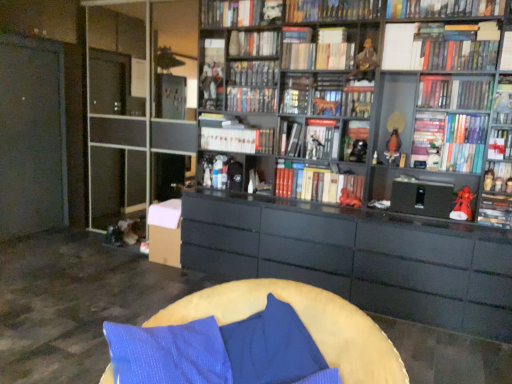
This screenshot has width=512, height=384. I want to click on hardcover book at upper center, which is counted as the 3th book, starting from the top, so click(x=443, y=8).

The image size is (512, 384). What do you see at coordinates (272, 347) in the screenshot?
I see `blue fabric pillow at lower center` at bounding box center [272, 347].

This screenshot has height=384, width=512. Describe the element at coordinates (251, 99) in the screenshot. I see `black matte bookshelf at center, which appears as the eleventh book when ordered from the bottom` at that location.

Identify the location of hardcover book at center, the 7th book positioned from the bottom. (290, 138).

I want to click on hardcover book at right, which is the 19th book in top-to-bottom order, so click(495, 210).

Is matte plastic figurine at upper center, positioned as the sixth book in top-to-bottom order, facing away from hardcover book at upper center, arranged as the 19th book when ordered from the bottom?

matte plastic figurine at upper center, positioned as the sixth book in top-to-bottom order, does not have its back to hardcover book at upper center, arranged as the 19th book when ordered from the bottom.

Is point (206, 52) farther from camera compared to point (218, 10)?

No, it is not.

Considering the sizes of objects matte plastic figurine at upper center, positioned as the sixth book in top-to-bottom order, and hardcover book at upper center, acting as the 1th book starting from the top, in the image provided, who is thinner, matte plastic figurine at upper center, positioned as the sixth book in top-to-bottom order, or hardcover book at upper center, acting as the 1th book starting from the top,?

matte plastic figurine at upper center, positioned as the sixth book in top-to-bottom order.

From the image's perspective, is matte plastic figurine at upper center, positioned as the sixth book in top-to-bottom order, beneath hardcover book at upper center, acting as the 1th book starting from the top?

Yes, from the image's perspective, matte plastic figurine at upper center, positioned as the sixth book in top-to-bottom order, is below hardcover book at upper center, acting as the 1th book starting from the top.

Could you tell me if soft yellow cushion at lower center is turned towards matte black book at center, the 14th book in the top-to-bottom sequence?

No, soft yellow cushion at lower center is not oriented towards matte black book at center, the 14th book in the top-to-bottom sequence.

Considering their positions, is soft yellow cushion at lower center located in front of or behind matte black book at center, which appears as the sixth book when ordered from the bottom?

In the image, soft yellow cushion at lower center appears in front of matte black book at center, which appears as the sixth book when ordered from the bottom.

Does point (265, 290) appear closer or farther from the camera than point (344, 147)?

Clearly, point (265, 290) is closer to the camera than point (344, 147).

Is there a large distance between matte plastic figurine at upper center, positioned as the sixth book in top-to-bottom order, and hardcover book at upper right, the 9th book positioned from the bottom?

That's right, there is a large distance between matte plastic figurine at upper center, positioned as the sixth book in top-to-bottom order, and hardcover book at upper right, the 9th book positioned from the bottom.

Does matte plastic figurine at upper center, acting as the 14th book starting from the bottom, have a lesser width compared to hardcover book at upper right, the 9th book positioned from the bottom?

No, matte plastic figurine at upper center, acting as the 14th book starting from the bottom, is not thinner than hardcover book at upper right, the 9th book positioned from the bottom.

Can you confirm if matte plastic figurine at upper center, acting as the 14th book starting from the bottom, is positioned to the right of hardcover book at upper right, the 9th book positioned from the bottom?

No, matte plastic figurine at upper center, acting as the 14th book starting from the bottom, is not to the right of hardcover book at upper right, the 9th book positioned from the bottom.

From a real-world perspective, which object rests below the other?

red matte bookshelf at center, the 2th book ordered from the bottom, is physically lower.

Can you confirm if red matte bookshelf at center, the 2th book ordered from the bottom, is shorter than white glossy book at upper right, the 16th book positioned from the top?

Incorrect, the height of red matte bookshelf at center, the 2th book ordered from the bottom, does not fall short of that of white glossy book at upper right, the 16th book positioned from the top.

Considering the relative positions of red matte bookshelf at center, marked as the eighteenth book in a top-to-bottom arrangement, and white glossy book at upper right, the 16th book positioned from the top, in the image provided, is red matte bookshelf at center, marked as the eighteenth book in a top-to-bottom arrangement, to the right of white glossy book at upper right, the 16th book positioned from the top, from the viewer's perspective?

No.

Could you tell me if red matte bookshelf at center, the 2th book ordered from the bottom, is turned towards white glossy book at upper right, which ranks as the 4th book in bottom-to-top order?

No, red matte bookshelf at center, the 2th book ordered from the bottom, is not turned towards white glossy book at upper right, which ranks as the 4th book in bottom-to-top order.

Is matte red figurine at right in contact with hardcover book at upper right, the twelfth book when ordered from bottom to top?

matte red figurine at right and hardcover book at upper right, the twelfth book when ordered from bottom to top, are not in contact.

Is matte red figurine at right spatially inside hardcover book at upper right, the twelfth book when ordered from bottom to top, or outside of it?

The correct answer is: outside.

Is matte red figurine at right closer to camera compared to hardcover book at upper right, the twelfth book when ordered from bottom to top?

No, matte red figurine at right is behind hardcover book at upper right, the twelfth book when ordered from bottom to top.

From a real-world perspective, who is located higher, matte red figurine at right or hardcover book at upper right, the twelfth book when ordered from bottom to top?

From a 3D spatial view, hardcover book at upper right, the twelfth book when ordered from bottom to top, is above.

Consider the image. Which is closer to the camera, (344, 33) or (492, 215)?

Clearly, point (344, 33) is more distant from the camera than point (492, 215).

Is the depth of hardcover book at center, the fifteenth book when ordered from bottom to top, greater than that of hardcover book at right, marked as the first book in a bottom-to-top arrangement?

Yes, it is.

Which of these two, hardcover book at center, arranged as the 5th book when viewed from the top, or hardcover book at right, marked as the first book in a bottom-to-top arrangement, stands taller?

Standing taller between the two is hardcover book at right, marked as the first book in a bottom-to-top arrangement.

Consider the image. Which is behind, black matte bookshelf at center, which appears as the 9th book when viewed from the top, or hardcover book at upper right, which ranks as the fifteenth book in top-to-bottom order?

black matte bookshelf at center, which appears as the 9th book when viewed from the top, is more distant.

From the image's perspective, is black matte bookshelf at center, which appears as the eleventh book when ordered from the bottom, located beneath hardcover book at upper right, the 5th book ordered from the bottom?

No, from the image's perspective, black matte bookshelf at center, which appears as the eleventh book when ordered from the bottom, is not beneath hardcover book at upper right, the 5th book ordered from the bottom.

Image resolution: width=512 pixels, height=384 pixels. Find the location of `the 9th book in front when counting from the black matte bookshelf at center, which appears as the eleventh book when ordered from the bottom`. the 9th book in front when counting from the black matte bookshelf at center, which appears as the eleventh book when ordered from the bottom is located at coordinates [428, 138].

How different are the orientations of black matte bookshelf at center, which appears as the eleventh book when ordered from the bottom, and hardcover book at upper right, which ranks as the fifteenth book in top-to-bottom order, in degrees?

The facing directions of black matte bookshelf at center, which appears as the eleventh book when ordered from the bottom, and hardcover book at upper right, which ranks as the fifteenth book in top-to-bottom order, are 0.312 degrees apart.

The height and width of the screenshot is (384, 512). I want to click on book that is the 7th one above the matte plastic figurine at upper center, positioned as the sixth book in top-to-bottom order (from a real-world perspective), so click(230, 13).

The image size is (512, 384). I want to click on furniture directly beneath the matte black book at center, which appears as the sixth book when ordered from the bottom (from a real-world perspective), so click(303, 322).

Estimate the real-world distances between objects in this image. Which object is closer to red matte bookshelf at center, marked as the eighteenth book in a top-to-bottom arrangement, hardcover book at upper right, which ranks as the fifteenth book in top-to-bottom order, or matte black bookcase at upper right?

Based on the image, matte black bookcase at upper right appears to be nearer to red matte bookshelf at center, marked as the eighteenth book in a top-to-bottom arrangement.

When comparing their distances from matte black figurine at right, acting as the seventeenth book starting from the top, does white glossy book at upper right, the 16th book positioned from the top, or soft yellow cushion at lower center seem further?

soft yellow cushion at lower center is further to matte black figurine at right, acting as the seventeenth book starting from the top.

Considering their positions, is matte plastic figurine at upper center, acting as the 14th book starting from the bottom, positioned further to hardcover book at center, the 7th book positioned from the bottom, than hardcover book at upper center, arranged as the 19th book when ordered from the bottom?

Among the two, hardcover book at upper center, arranged as the 19th book when ordered from the bottom, is located further to hardcover book at center, the 7th book positioned from the bottom.

Based on their spatial positions, is hardcover book at upper right, the 5th book ordered from the bottom, or matte black figurine at right, acting as the seventeenth book starting from the top, further from soft yellow cushion at lower center?

Among the two, matte black figurine at right, acting as the seventeenth book starting from the top, is located further to soft yellow cushion at lower center.

Based on their spatial positions, is soft yellow cushion at lower center or matte black figurine at right, the 3th book from the bottom, closer to black matte bookshelf at center, which appears as the eleventh book when ordered from the bottom?

Among the two, matte black figurine at right, the 3th book from the bottom, is located nearer to black matte bookshelf at center, which appears as the eleventh book when ordered from the bottom.

From the picture: When comparing their distances from hardcover book at upper center, arranged as the 4th book when viewed from the top, does black matte bookshelf at center, which appears as the eleventh book when ordered from the bottom, or hardcover book at right, which is the 19th book in top-to-bottom order, seem further?

hardcover book at right, which is the 19th book in top-to-bottom order, is positioned further to the anchor hardcover book at upper center, arranged as the 4th book when viewed from the top.

Looking at the image, which one is located closer to hardcover book at upper center, the eighteenth book positioned from the bottom, matte red figurine at right or hardcover book at upper right, which is the eighth book in bottom-to-top order?

hardcover book at upper right, which is the eighth book in bottom-to-top order, lies closer to hardcover book at upper center, the eighteenth book positioned from the bottom, than the other object.

Based on their spatial positions, is hardcover book at right, marked as the first book in a bottom-to-top arrangement, or hardcover book at upper center, which is counted as the 3th book, starting from the top, further from matte black bookcase at upper right?

Based on the image, hardcover book at right, marked as the first book in a bottom-to-top arrangement, appears to be further to matte black bookcase at upper right.

Find the location of a particular element. bookcase between red matte bookshelf at center, the 2th book ordered from the bottom, and white glossy book at upper right, which ranks as the 4th book in bottom-to-top order is located at coordinates point(387,89).

Find the location of a particular element. This screenshot has width=512, height=384. bookcase located between matte plastic figurine at upper center, positioned as the sixth book in top-to-bottom order, and white glossy book at upper right, which ranks as the 4th book in bottom-to-top order, in the left-right direction is located at coordinates (387, 89).

Identify the location of bookcase located between hardcover book at center, the 7th book positioned from the bottom, and matte red figurine at right in the left-right direction. Image resolution: width=512 pixels, height=384 pixels. (387, 89).

This screenshot has width=512, height=384. Identify the location of bookcase situated between hardcover book at upper center, arranged as the 4th book when viewed from the top, and hardcover book at upper center, which is counted as the 3th book, starting from the top, from left to right. (x=387, y=89).